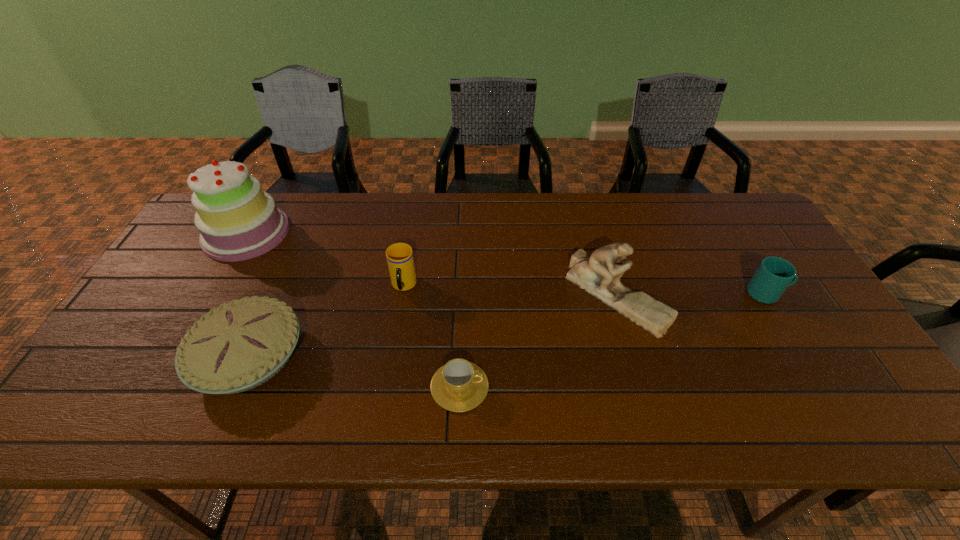
You are a GUI agent. You are given a task and a screenshot of the screen. Output one action in this format:
    pyautogui.click(x=<x>, y=<y>)
    Task: Click on the vacant space situated 0.150m on the front-facing side of the fifth shortest object
    This screenshot has height=540, width=960.
    Given the screenshot: What is the action you would take?
    pyautogui.click(x=644, y=392)

Where is `vacant space located 0.220m on the side of the leftmost cup with the handle`? This screenshot has height=540, width=960. vacant space located 0.220m on the side of the leftmost cup with the handle is located at coordinates (390, 370).

Image resolution: width=960 pixels, height=540 pixels. I want to click on vacant area situated 0.060m on the handle side of the second tallest cup, so click(808, 293).

This screenshot has height=540, width=960. Find the location of `free region located on the right of the pie`. free region located on the right of the pie is located at coordinates (395, 356).

Where is `free space located 0.330m with the handle on the side of the shortest object`? free space located 0.330m with the handle on the side of the shortest object is located at coordinates click(x=632, y=386).

At what (x,y) coordinates should I click in order to perform the action: click on object that is at the far edge. Please return your answer as a coordinate pair (x, y). The height and width of the screenshot is (540, 960). Looking at the image, I should click on (237, 220).

Image resolution: width=960 pixels, height=540 pixels. What are the coordinates of `pie that is positioned at the near edge` in the screenshot? It's located at (238, 346).

Find the location of a particular element. This screenshot has height=540, width=960. cup that is at the near edge is located at coordinates (459, 385).

Find the location of a particular element. The height and width of the screenshot is (540, 960). object located at the left edge is located at coordinates (237, 220).

You are a GUI agent. You are given a task and a screenshot of the screen. Output one action in this format:
    pyautogui.click(x=<x>, y=<y>)
    Task: Click on the object located in the right edge section of the desktop
    
    Given the screenshot: What is the action you would take?
    pyautogui.click(x=773, y=275)